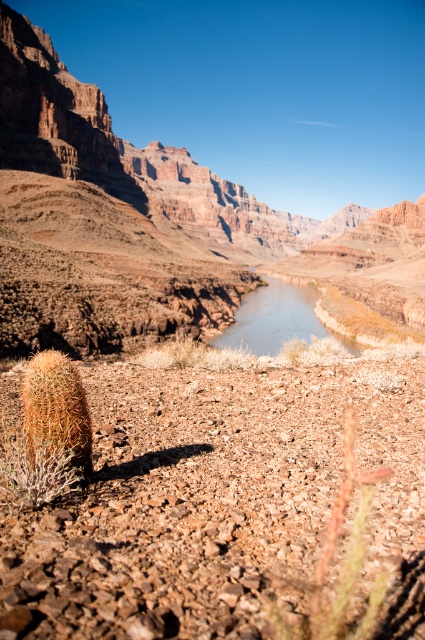
Question: Which object is closer to the camera taking this photo?

Choices:
 (A) brown fuzzy cactus at lower center
 (B) brown rocky canyon at center
 (C) clear water at center

Answer: (A)

Question: Where is brown rocky canyon at center located in relation to brown fuzzy cactus at lower center in the image?

Choices:
 (A) below
 (B) above

Answer: (B)

Question: Can you confirm if brown rocky canyon at center is bigger than clear water at center?

Choices:
 (A) no
 (B) yes

Answer: (B)

Question: Among these points, which one is nearest to the camera?

Choices:
 (A) (62, 376)
 (B) (376, 621)
 (C) (255, 257)

Answer: (B)

Question: Which point is farther to the camera?

Choices:
 (A) orange spiny cactus at lower left
 (B) clear water at center
 (C) brown fuzzy cactus at lower center

Answer: (B)

Question: Does brown fuzzy cactus at lower center have a larger size compared to clear water at center?

Choices:
 (A) yes
 (B) no

Answer: (B)